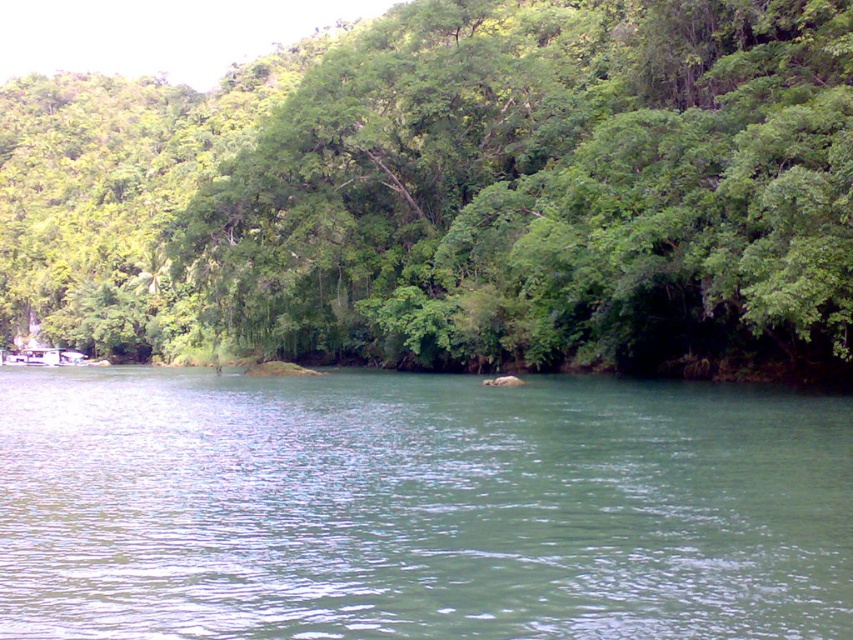
Who is shorter, green leafy trees at upper left or green smooth water at center?

With less height is green smooth water at center.

Is green leafy trees at upper left positioned before green smooth water at center?

No.

Between point (503, 161) and point (19, 490), which one is positioned in front?

Point (19, 490) is more forward.

The image size is (853, 640). Identify the location of green leafy trees at upper left. pos(456,195).